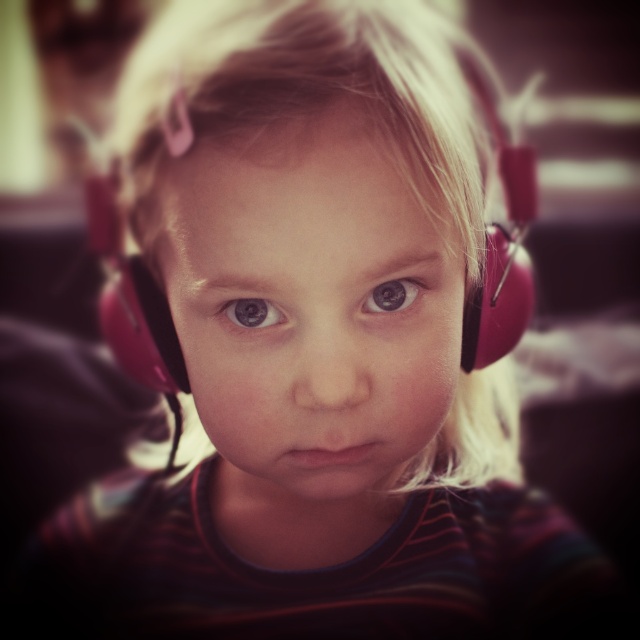
Based on the photo, which of these two, blue matte eye at center or brown matte eye at center, stands shorter?

With less height is brown matte eye at center.

Can you confirm if blue matte eye at center is smaller than brown matte eye at center?

Incorrect, blue matte eye at center is not smaller in size than brown matte eye at center.

What are the coordinates of `blue matte eye at center` in the screenshot? It's located at (252, 312).

The height and width of the screenshot is (640, 640). In order to click on blue matte eye at center in this screenshot , I will do `click(252, 312)`.